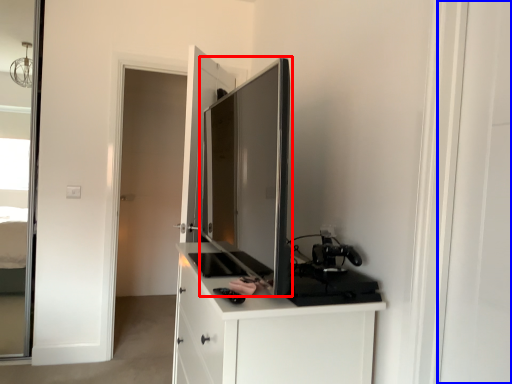
Question: Which of the following is the farthest to the observer, appliance (highlighted by a red box) or screen door (highlighted by a blue box)?

Choices:
 (A) appliance
 (B) screen door

Answer: (A)